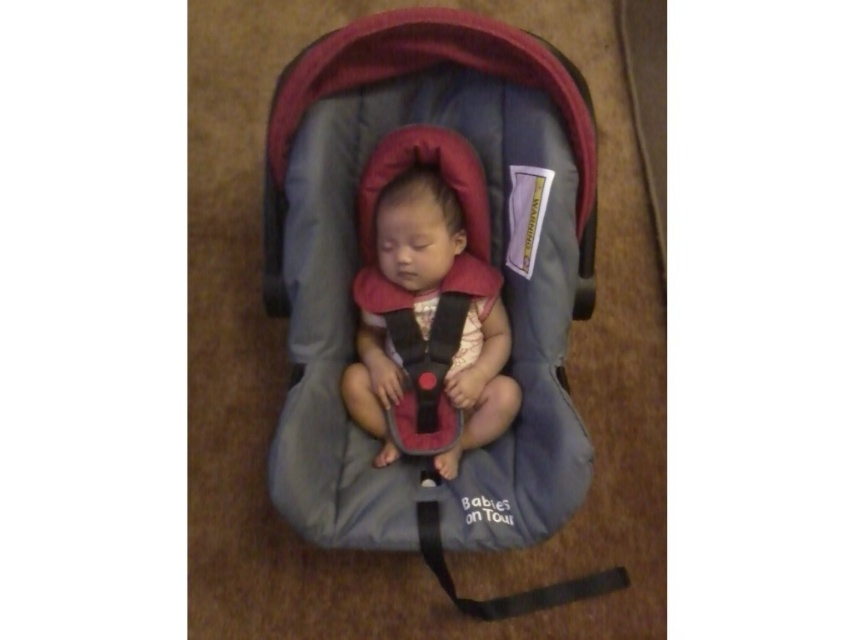
In the scene shown: You are a parent trying to secure your baby in the car seat. You need to fasten the straps properly. Which object should you adjust first, the matte black baby carrier at center or the black fabric strap at center?

The matte black baby carrier at center is located above the black fabric strap at center, so you should adjust the black fabric strap at center first before securing the matte black baby carrier at center.

You are a parent trying to place a small toy box that measures 12 inches in width on the floor next to the gray fabric baby carriage at center. Based on the scene description, can you determine if there is enough space to place the toy box without moving the baby carriage?

The gray fabric baby carriage at center is located at point (442,282). Since the toy box measures 12 inches in width, and the scene does not provide specific spatial dimensions or distances between objects, it is impossible to determine if there is sufficient space to place the toy box without moving the baby carriage.